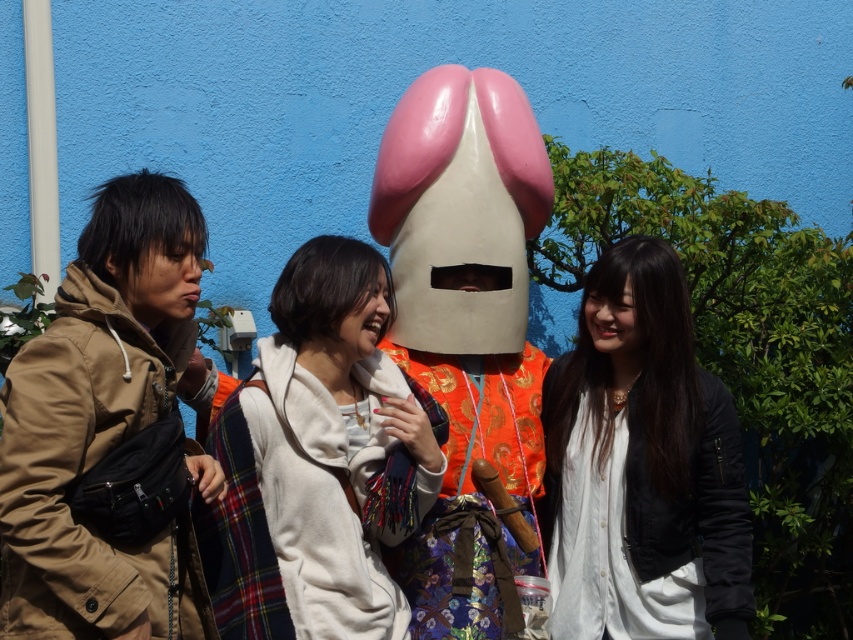
Question: Does brown matte jacket at left have a greater width compared to white soft scarf at center?

Choices:
 (A) yes
 (B) no

Answer: (B)

Question: Is glossy plastic mask at center closer to the viewer compared to white soft scarf at center?

Choices:
 (A) no
 (B) yes

Answer: (A)

Question: Based on their relative distances, which object is nearer to the white soft scarf at center?

Choices:
 (A) black leather jacket at right
 (B) glossy plastic mask at center
 (C) brown matte jacket at left

Answer: (B)

Question: Estimate the real-world distances between objects in this image. Which object is closer to the white soft scarf at center?

Choices:
 (A) brown matte jacket at left
 (B) black leather jacket at right

Answer: (A)

Question: Which point is farther to the camera?

Choices:
 (A) orange fabric costume at center
 (B) black leather jacket at right
 (C) white soft scarf at center
 (D) glossy plastic mask at center

Answer: (A)

Question: Can you confirm if glossy plastic mask at center is wider than black leather jacket at right?

Choices:
 (A) yes
 (B) no

Answer: (A)